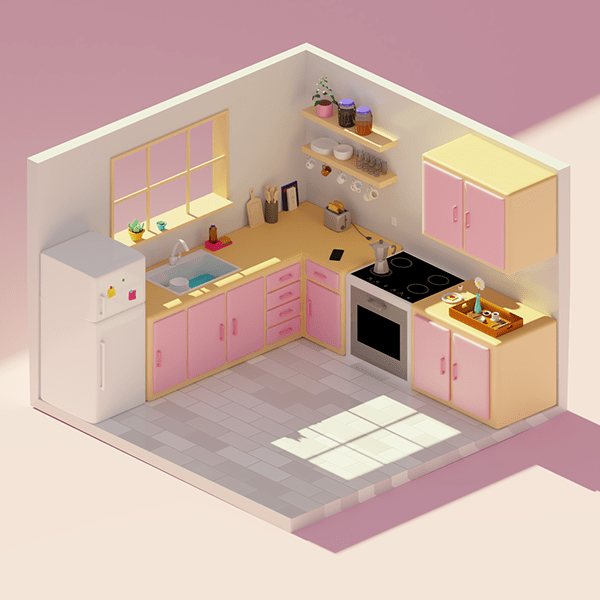
What are the coordinates of `white tiles` in the screenshot? It's located at (383, 412), (422, 427), (377, 440), (343, 423), (313, 440), (331, 460).